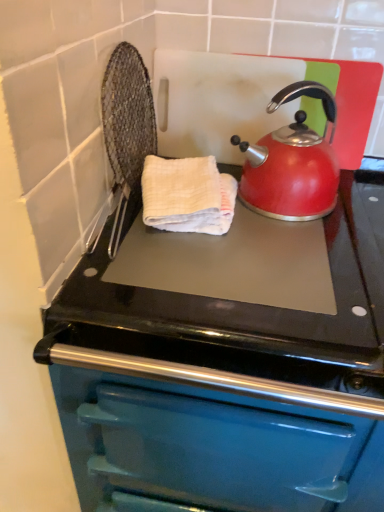
Identify the location of free point in front of white textured hand towel at center. The height and width of the screenshot is (512, 384). (181, 275).